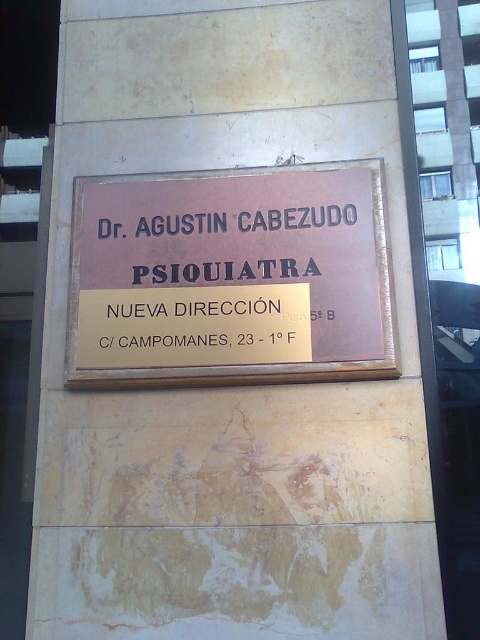
Question: Among these objects, which one is nearest to the camera?

Choices:
 (A) gold metallic sign at center
 (B) brown polished wood sign at center

Answer: (B)

Question: Does brown polished wood sign at center lie in front of gold metallic sign at center?

Choices:
 (A) yes
 (B) no

Answer: (A)

Question: Is brown polished wood sign at center to the right of gold metallic sign at center from the viewer's perspective?

Choices:
 (A) yes
 (B) no

Answer: (B)

Question: Is brown polished wood sign at center smaller than gold metallic sign at center?

Choices:
 (A) yes
 (B) no

Answer: (B)

Question: Which point is farther to the camera?

Choices:
 (A) gold metallic sign at center
 (B) brown polished wood sign at center

Answer: (A)